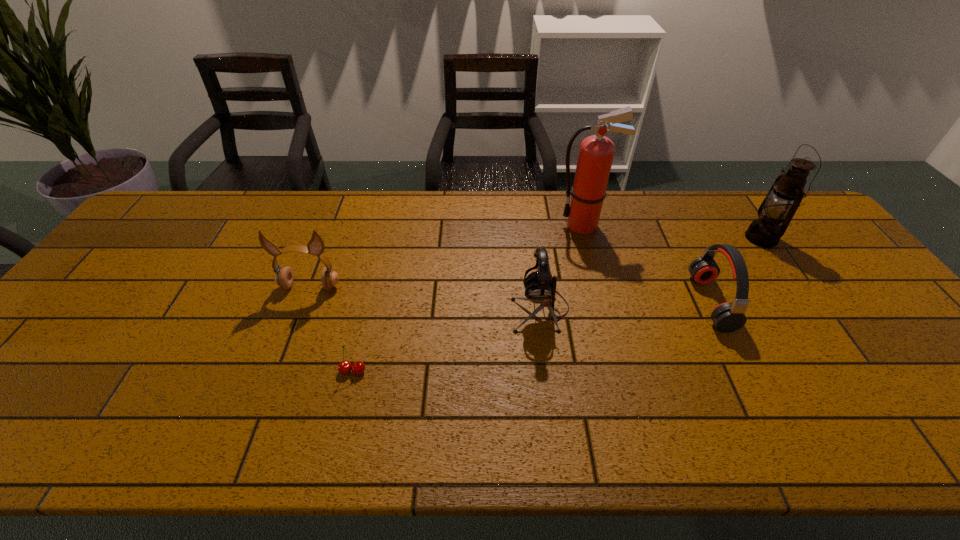
The height and width of the screenshot is (540, 960). Identify the location of fire extinguisher that is at the far edge. (596, 152).

Locate an element on the screen. oil lamp present at the far edge is located at coordinates (784, 197).

The width and height of the screenshot is (960, 540). I want to click on object located at the right edge, so click(784, 197).

Where is `object present at the far right corner`? object present at the far right corner is located at coordinates (784, 197).

Where is `vacant region at the far edge`? vacant region at the far edge is located at coordinates (647, 205).

The image size is (960, 540). In the image, there is a desktop. Find the location of `free space at the near edge`. free space at the near edge is located at coordinates (177, 450).

In the image, there is a desktop. At what (x,y) coordinates should I click in order to perform the action: click on free region at the left edge. Please return your answer as a coordinate pair (x, y). The image size is (960, 540). Looking at the image, I should click on (75, 314).

In order to click on vacant space at the far left corner of the desktop in this screenshot , I will do `click(207, 207)`.

You are a GUI agent. You are given a task and a screenshot of the screen. Output one action in this format:
    pyautogui.click(x=<x>, y=<y>)
    Task: Click on the free space that is in between the second earphone from left to right and the leftmost object
    This screenshot has height=540, width=960.
    Given the screenshot: What is the action you would take?
    pyautogui.click(x=425, y=299)

Find the location of a particular element. This screenshot has height=540, width=960. free space between the oil lamp and the second earphone from right to left is located at coordinates (651, 274).